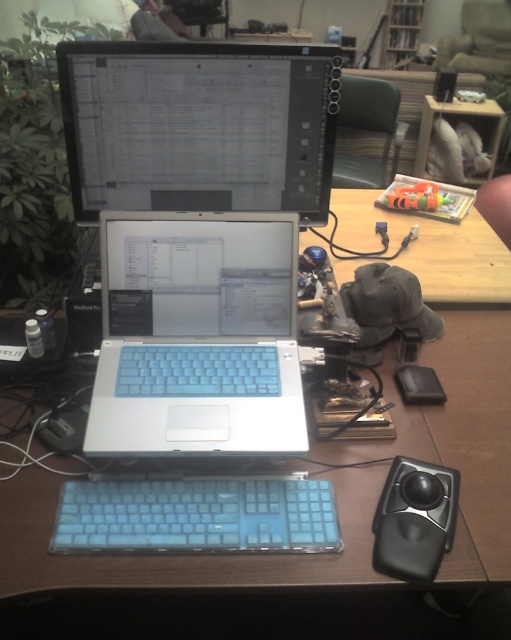
Question: Can you confirm if satin silver laptop at center is smaller than white rubberized laptop at center?

Choices:
 (A) no
 (B) yes

Answer: (A)

Question: Which point appears farthest from the camera in this image?

Choices:
 (A) (438, 93)
 (B) (146, 481)

Answer: (A)

Question: Which of the following is the closest to the observer?

Choices:
 (A) translucent blue keyboard at center
 (B) white rubberized laptop at center

Answer: (A)

Question: Can you confirm if wooden table at center is positioned above translucent blue keyboard at center?

Choices:
 (A) yes
 (B) no

Answer: (A)

Question: Can you confirm if satin silver laptop at center is bigger than wooden table at center?

Choices:
 (A) no
 (B) yes

Answer: (A)

Question: Which point is closer to the camera taking this photo?

Choices:
 (A) (122, 394)
 (B) (429, 561)
 (C) (174, 426)
 (D) (326, 128)

Answer: (B)